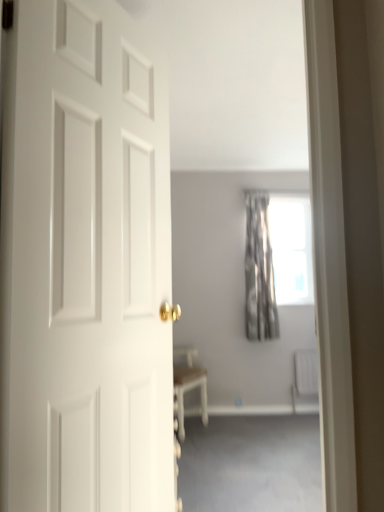
Locate an element on the screen. silvery metallic curtain at center is located at coordinates (259, 272).

This screenshot has height=512, width=384. Find the location of `gray fabric curtain at upper center`. gray fabric curtain at upper center is located at coordinates (251, 464).

The width and height of the screenshot is (384, 512). Describe the element at coordinates (85, 265) in the screenshot. I see `white matte door at left` at that location.

Where is `silvery metallic curtain at center`? The height and width of the screenshot is (512, 384). silvery metallic curtain at center is located at coordinates (259, 272).

Which is further, [310,368] or [257,335]?

The point [310,368] is farther.

In terms of width, does white plastic radiator at lower right look wider or thinner when compared to silvery metallic curtain at center?

In the image, white plastic radiator at lower right appears to be more narrow than silvery metallic curtain at center.

Considering the sizes of objects white plastic radiator at lower right and silvery metallic curtain at center in the image provided, who is taller, white plastic radiator at lower right or silvery metallic curtain at center?

Standing taller between the two is silvery metallic curtain at center.

Between white plastic radiator at lower right and silvery metallic curtain at center, which one appears on the right side from the viewer's perspective?

white plastic radiator at lower right is more to the right.

Based on the photo, is gray fabric curtain at upper center facing away from silvery metallic curtain at center?

No.

From a real-world perspective, which object rests below the other?

From a 3D spatial view, gray fabric curtain at upper center is below.

Considering the positions of objects gray fabric curtain at upper center and silvery metallic curtain at center in the image provided, who is more to the left, gray fabric curtain at upper center or silvery metallic curtain at center?

gray fabric curtain at upper center.

Is gray fabric curtain at upper center oriented away from white matte door at left?

gray fabric curtain at upper center is not turned away from white matte door at left.

You are a GUI agent. You are given a task and a screenshot of the screen. Output one action in this format:
    pyautogui.click(x=<x>, y=<y>)
    Task: Click on the door on the left of gray fabric curtain at upper center
    Image resolution: width=384 pixels, height=512 pixels.
    Given the screenshot: What is the action you would take?
    pyautogui.click(x=85, y=265)

Looking at this image, is gray fabric curtain at upper center not within white matte door at left?

Yes, gray fabric curtain at upper center is located beyond the bounds of white matte door at left.

Considering the positions of objects gray fabric curtain at upper center and white matte door at left in the image provided, who is more to the left, gray fabric curtain at upper center or white matte door at left?

From the viewer's perspective, white matte door at left appears more on the left side.

From the image's perspective, which is above, white plastic radiator at lower right or gray fabric curtain at upper center?

white plastic radiator at lower right, from the image's perspective.

I want to click on radiator above the gray fabric curtain at upper center (from a real-world perspective), so click(x=306, y=372).

From a real-world perspective, is white plastic radiator at lower right positioned above or below gray fabric curtain at upper center?

Clearly, from a real-world perspective, white plastic radiator at lower right is above gray fabric curtain at upper center.

How far apart are white plastic radiator at lower right and gray fabric curtain at upper center?

A distance of 3.35 feet exists between white plastic radiator at lower right and gray fabric curtain at upper center.

Would you say white matte door at left is part of silvery metallic curtain at center's contents?

Definitely not — white matte door at left is not inside silvery metallic curtain at center.

From a real-world perspective, is silvery metallic curtain at center positioned over white matte door at left based on gravity?

Correct, in the physical world, silvery metallic curtain at center is higher than white matte door at left.

Image resolution: width=384 pixels, height=512 pixels. There is a white matte door at left. In order to click on curtain above it (from a real-world perspective) in this screenshot , I will do `click(259, 272)`.

Is silvery metallic curtain at center not close to white matte door at left?

Indeed, silvery metallic curtain at center is not near white matte door at left.

Is silvery metallic curtain at center far from gray fabric curtain at upper center?

Yes, silvery metallic curtain at center and gray fabric curtain at upper center are located far from each other.

Where is `curtain above the gray fabric curtain at upper center (from the image's perspective)`? The height and width of the screenshot is (512, 384). curtain above the gray fabric curtain at upper center (from the image's perspective) is located at coordinates (259, 272).

Is silvery metallic curtain at center located outside gray fabric curtain at upper center?

A: silvery metallic curtain at center is positioned outside gray fabric curtain at upper center.

Which of these two, silvery metallic curtain at center or gray fabric curtain at upper center, is wider?

Wider between the two is gray fabric curtain at upper center.

Can you tell me how much gray fabric curtain at upper center and white plastic radiator at lower right differ in facing direction?

The facing directions of gray fabric curtain at upper center and white plastic radiator at lower right are 0.554 degrees apart.

Is gray fabric curtain at upper center to the left of white plastic radiator at lower right from the viewer's perspective?

Correct, you'll find gray fabric curtain at upper center to the left of white plastic radiator at lower right.

Can you confirm if gray fabric curtain at upper center is taller than white plastic radiator at lower right?

In fact, gray fabric curtain at upper center may be shorter than white plastic radiator at lower right.

What are the coordinates of `curtain that appears above the white plastic radiator at lower right (from a real-world perspective)` in the screenshot? It's located at (259, 272).

Find the location of a particular element. The image size is (384, 512). curtain lying above the gray fabric curtain at upper center (from the image's perspective) is located at coordinates (259, 272).

Looking at the image, which one is located further to gray fabric curtain at upper center, silvery metallic curtain at center or white plastic radiator at lower right?

silvery metallic curtain at center is further to gray fabric curtain at upper center.

Consider the image. Estimate the real-world distances between objects in this image. Which object is further from silvery metallic curtain at center, white plastic radiator at lower right or gray fabric curtain at upper center?

gray fabric curtain at upper center lies further to silvery metallic curtain at center than the other object.

In the scene shown: Considering their positions, is silvery metallic curtain at center positioned further to white matte door at left than white plastic radiator at lower right?

The object further to white matte door at left is white plastic radiator at lower right.

Considering their positions, is gray fabric curtain at upper center positioned closer to white plastic radiator at lower right than silvery metallic curtain at center?

silvery metallic curtain at center is positioned closer to the anchor white plastic radiator at lower right.

Which object lies further to the anchor point silvery metallic curtain at center, gray fabric curtain at upper center or white matte door at left?

The object further to silvery metallic curtain at center is white matte door at left.

Based on the photo, considering their positions, is silvery metallic curtain at center positioned closer to white plastic radiator at lower right than white matte door at left?

The object closer to white plastic radiator at lower right is silvery metallic curtain at center.

From the picture: Considering their positions, is gray fabric curtain at upper center positioned further to white plastic radiator at lower right than white matte door at left?

white matte door at left lies further to white plastic radiator at lower right than the other object.

When comparing their distances from gray fabric curtain at upper center, does silvery metallic curtain at center or white matte door at left seem further?

white matte door at left is further to gray fabric curtain at upper center.

Identify the location of curtain between gray fabric curtain at upper center and white plastic radiator at lower right in the front-back direction. The height and width of the screenshot is (512, 384). (259, 272).

The height and width of the screenshot is (512, 384). Identify the location of corridor between white matte door at left and silvery metallic curtain at center from front to back. (251, 464).

The width and height of the screenshot is (384, 512). I want to click on corridor between white matte door at left and white plastic radiator at lower right in the front-back direction, so click(x=251, y=464).

You are a GUI agent. You are given a task and a screenshot of the screen. Output one action in this format:
    pyautogui.click(x=<x>, y=<y>)
    Task: Click on the curtain located between white matte door at left and white plastic radiator at lower right in the depth direction
    This screenshot has width=384, height=512.
    Given the screenshot: What is the action you would take?
    pyautogui.click(x=259, y=272)